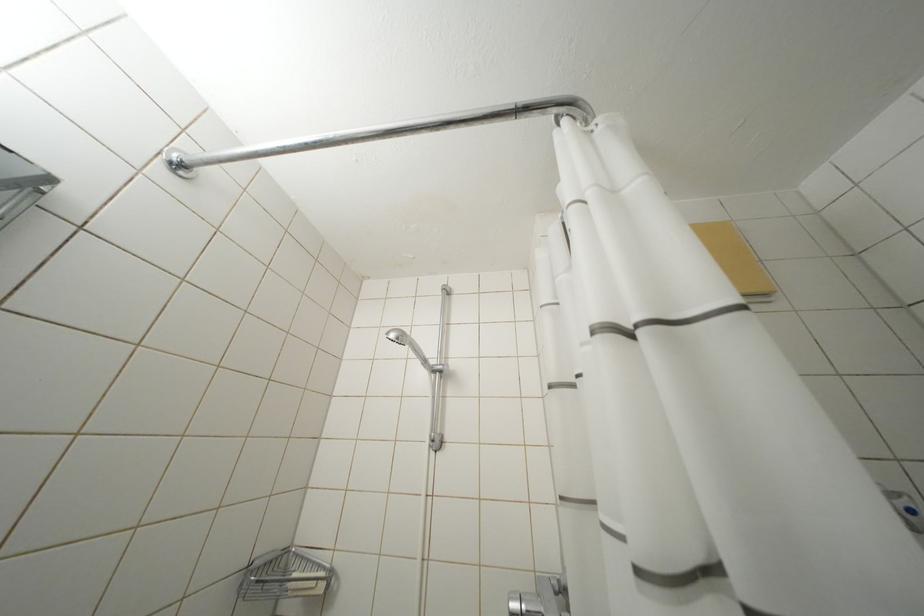
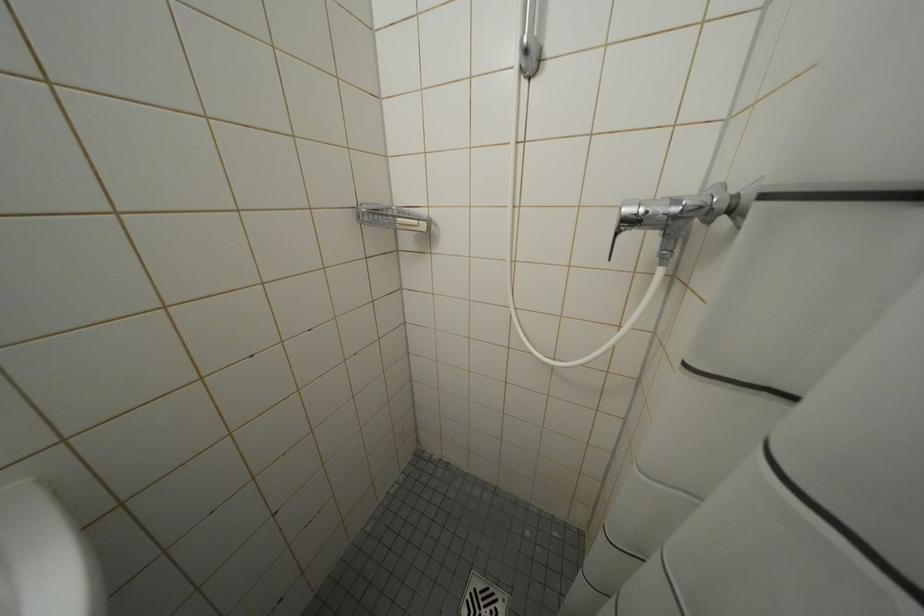
First-person continuous shooting, in which direction is the camera rotating?

The camera's rotation is toward left-down.